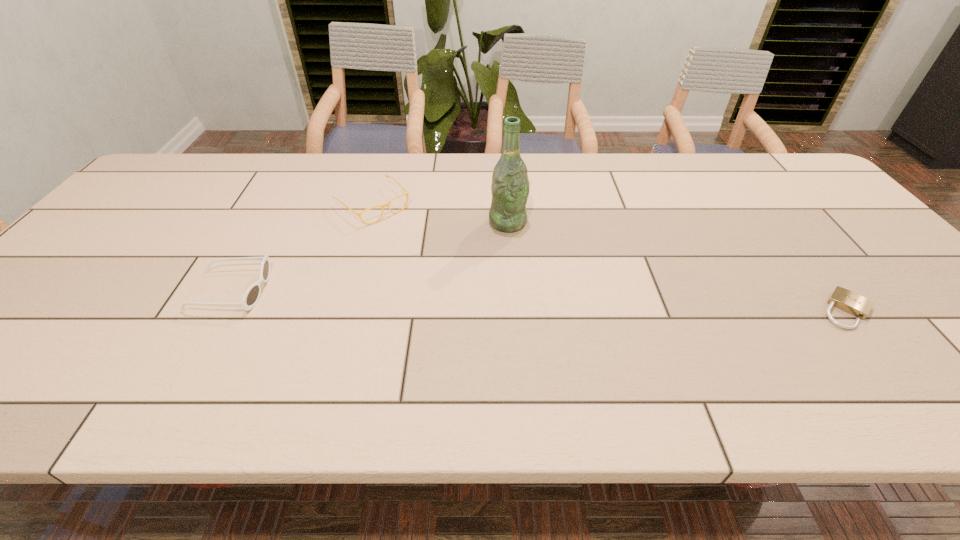
Find the location of `blank area at the right edge`. blank area at the right edge is located at coordinates (804, 218).

Locate an element on the screen. free space at the far left corner is located at coordinates (160, 177).

This screenshot has width=960, height=540. I want to click on vacant space at the near right corner of the desktop, so click(945, 343).

Where is `unoccupied area between the beer bottle and the leftmost object`? unoccupied area between the beer bottle and the leftmost object is located at coordinates (370, 256).

The image size is (960, 540). I want to click on free point between the beer bottle and the leftmost object, so click(370, 256).

Locate an element on the screen. The image size is (960, 540). unoccupied area between the second object from right to left and the rightmost object is located at coordinates (x=677, y=266).

Find the location of a particular element. free space between the spectacles and the padlock is located at coordinates (610, 258).

At what (x,y) coordinates should I click in order to perform the action: click on vacant region between the sunglasses and the second object from left to right. Please return your answer as a coordinate pair (x, y). The height and width of the screenshot is (540, 960). Looking at the image, I should click on (301, 248).

This screenshot has height=540, width=960. I want to click on vacant area that lies between the spectacles and the sunglasses, so click(301, 248).

Where is `vacant area that lies between the second object from right to left and the spectacles`? This screenshot has width=960, height=540. vacant area that lies between the second object from right to left and the spectacles is located at coordinates (441, 214).